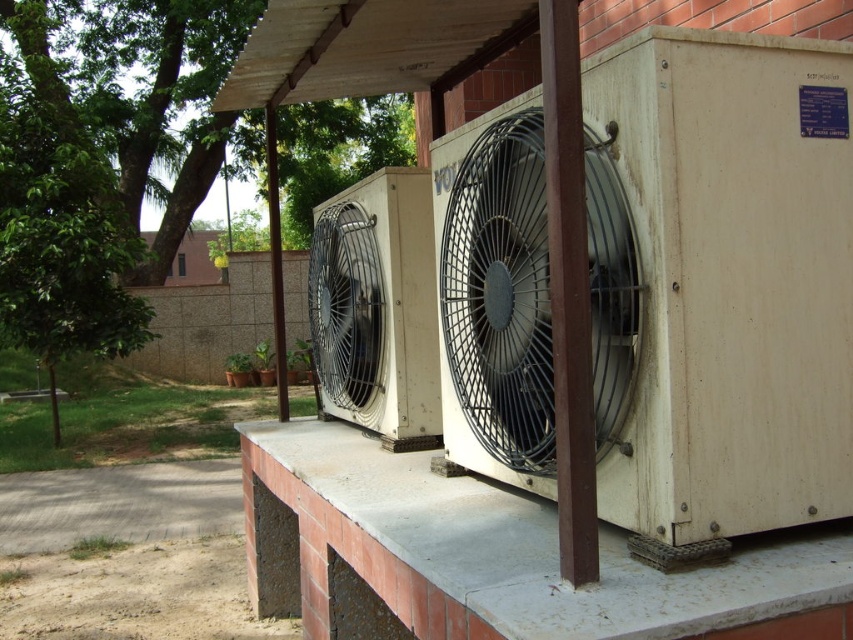
Can you confirm if white concrete ledge at center is shorter than metallic gray fan at center?

No.

Can you confirm if white concrete ledge at center is wider than metallic gray fan at center?

Correct, the width of white concrete ledge at center exceeds that of metallic gray fan at center.

Is point (431, 499) positioned after point (520, 304)?

Yes, point (431, 499) is behind point (520, 304).

Locate an element on the screen. This screenshot has width=853, height=640. white concrete ledge at center is located at coordinates (489, 557).